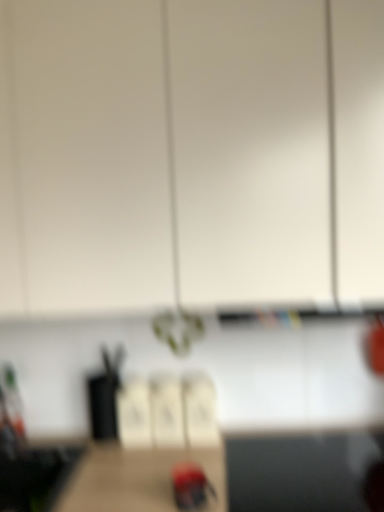
Identify the location of white matte cabinet at upper center. pos(190,154).

In order to face white matte cabinet at upper center, should I rotate leftwards or rightwards?

To align with it, rotate left about 2.093°.

The image size is (384, 512). Describe the element at coordinates (190, 154) in the screenshot. I see `white matte cabinet at upper center` at that location.

The width and height of the screenshot is (384, 512). What do you see at coordinates (191, 487) in the screenshot? I see `smooth red woodpecker at center` at bounding box center [191, 487].

In order to face smooth red woodpecker at center, should I rotate leftwards or rightwards?

It's best to rotate left around 0.185 degrees.

Where is `smooth red woodpecker at center`? smooth red woodpecker at center is located at coordinates (191, 487).

The height and width of the screenshot is (512, 384). Find the location of `white matte cabinet at upper center`. white matte cabinet at upper center is located at coordinates (190, 154).

Visually, is white matte cabinet at upper center positioned to the left or to the right of smooth red woodpecker at center?

Clearly, white matte cabinet at upper center is on the left of smooth red woodpecker at center in the image.

Considering the relative positions of white matte cabinet at upper center and smooth red woodpecker at center in the image provided, is white matte cabinet at upper center in front of smooth red woodpecker at center?

Yes, white matte cabinet at upper center is closer to the viewer.

Is point (301, 63) farther from viewer compared to point (180, 497)?

That is False.

From the image's perspective, is white matte cabinet at upper center above or below smooth red woodpecker at center?

Clearly, from the image's perspective, white matte cabinet at upper center is above smooth red woodpecker at center.

From a real-world perspective, is white matte cabinet at upper center positioned under smooth red woodpecker at center based on gravity?

No, from a real-world perspective, white matte cabinet at upper center is not beneath smooth red woodpecker at center.

Which object is wider, white matte cabinet at upper center or smooth red woodpecker at center?

white matte cabinet at upper center is wider.

Considering the sizes of objects white matte cabinet at upper center and smooth red woodpecker at center in the image provided, who is taller, white matte cabinet at upper center or smooth red woodpecker at center?

white matte cabinet at upper center.

Between white matte cabinet at upper center and smooth red woodpecker at center, which one has larger size?

white matte cabinet at upper center.

Is white matte cabinet at upper center inside or outside of smooth red woodpecker at center?

white matte cabinet at upper center is not enclosed by smooth red woodpecker at center.

Is white matte cabinet at upper center placed right next to smooth red woodpecker at center?

They are not placed beside each other.

Is smooth red woodpecker at center at the back of white matte cabinet at upper center?

No, white matte cabinet at upper center is not facing the opposite direction of smooth red woodpecker at center.

How different are the orientations of white matte cabinet at upper center and smooth red woodpecker at center in degrees?

white matte cabinet at upper center and smooth red woodpecker at center are facing 0.000128 degrees away from each other.

Locate an element on the screen. This screenshot has width=384, height=512. woodpecker below the white matte cabinet at upper center (from a real-world perspective) is located at coordinates (191, 487).

Between smooth red woodpecker at center and white matte cabinet at upper center, which one appears on the right side from the viewer's perspective?

From the viewer's perspective, smooth red woodpecker at center appears more on the right side.

Considering their positions, is smooth red woodpecker at center located in front of or behind white matte cabinet at upper center?

Clearly, smooth red woodpecker at center is behind white matte cabinet at upper center.

Which is in front, point (189, 465) or point (273, 130)?

The point (273, 130) is closer to the camera.

From the image's perspective, is smooth red woodpecker at center above or below white matte cabinet at upper center?

Clearly, from the image's perspective, smooth red woodpecker at center is below white matte cabinet at upper center.

From the picture: From a real-world perspective, which is physically above, smooth red woodpecker at center or white matte cabinet at upper center?

white matte cabinet at upper center.

Is smooth red woodpecker at center thinner than white matte cabinet at upper center?

Indeed, smooth red woodpecker at center has a lesser width compared to white matte cabinet at upper center.

Considering the relative sizes of smooth red woodpecker at center and white matte cabinet at upper center in the image provided, is smooth red woodpecker at center taller than white matte cabinet at upper center?

In fact, smooth red woodpecker at center may be shorter than white matte cabinet at upper center.

Who is smaller, smooth red woodpecker at center or white matte cabinet at upper center?

smooth red woodpecker at center is smaller.

From the picture: Is smooth red woodpecker at center completely or partially outside of white matte cabinet at upper center?

Absolutely, smooth red woodpecker at center is external to white matte cabinet at upper center.

Is the surface of smooth red woodpecker at center in direct contact with white matte cabinet at upper center?

No, smooth red woodpecker at center is not beside white matte cabinet at upper center.

Is smooth red woodpecker at center facing away from white matte cabinet at upper center?

No.

How different are the orientations of smooth red woodpecker at center and white matte cabinet at upper center in degrees?

There is a 0.000128-degree angle between the facing directions of smooth red woodpecker at center and white matte cabinet at upper center.

Where is `woodpecker behind the white matte cabinet at upper center`? This screenshot has height=512, width=384. woodpecker behind the white matte cabinet at upper center is located at coordinates (191, 487).

The width and height of the screenshot is (384, 512). I want to click on cabinetry that appears on the left of smooth red woodpecker at center, so [x=190, y=154].

Find the location of a particular element. The image size is (384, 512). cabinetry in front of the smooth red woodpecker at center is located at coordinates (190, 154).